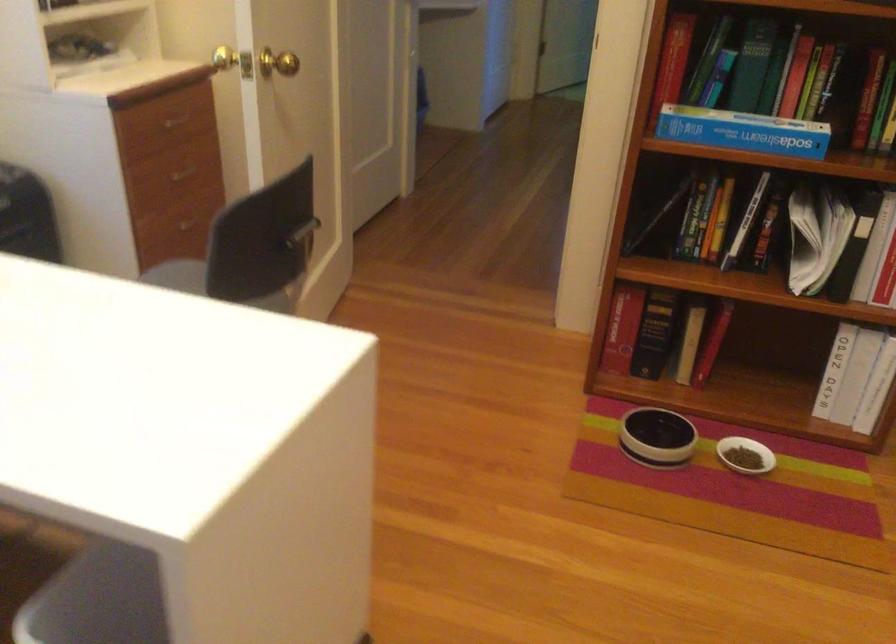
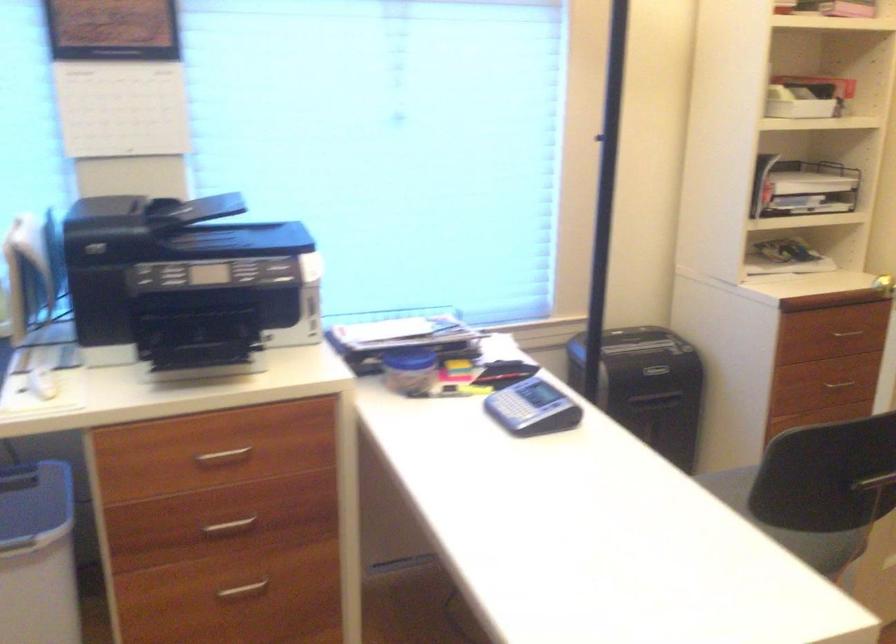
In the second image, find the point that corresponds to point 178,125 in the first image.

(847, 333)